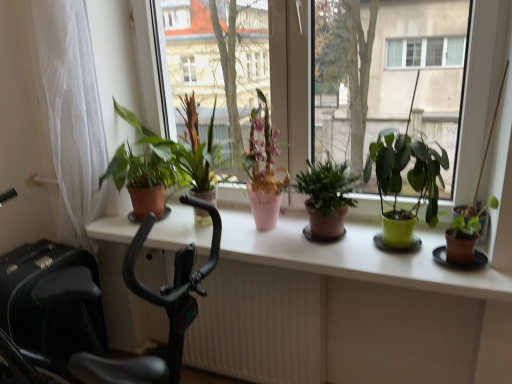
The width and height of the screenshot is (512, 384). In order to click on free spot below pink ceramic vase at center, which ranks as the 2th houseplant in left-to-right order (from a real-world perspective) in this screenshot , I will do `click(266, 232)`.